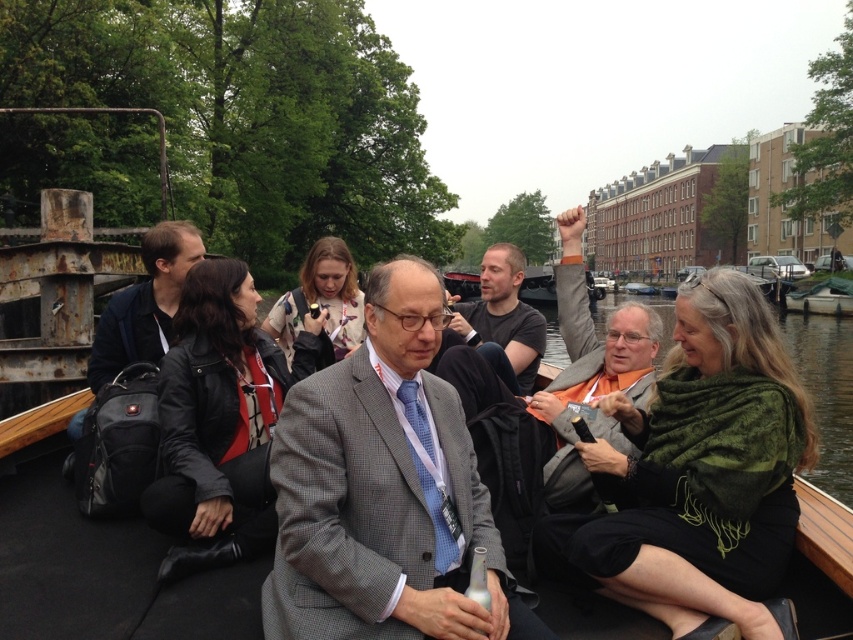
Can you confirm if orange fabric sweater at center is wider than green scarf at upper right?

In fact, orange fabric sweater at center might be narrower than green scarf at upper right.

Is point (646, 397) positioned behind point (660, 301)?

No.

Locate an element on the screen. Image resolution: width=853 pixels, height=640 pixels. orange fabric sweater at center is located at coordinates (589, 364).

Between gray checkered suit at center and green scarf at upper right, which one appears on the left side from the viewer's perspective?

From the viewer's perspective, gray checkered suit at center appears more on the left side.

Who is more distant from viewer, (323, 588) or (807, 365)?

Positioned behind is point (807, 365).

You are a GUI agent. You are given a task and a screenshot of the screen. Output one action in this format:
    pyautogui.click(x=<x>, y=<y>)
    Task: Click on the gray checkered suit at center
    
    Given the screenshot: What is the action you would take?
    pyautogui.click(x=383, y=490)

Can you confirm if green scarf at upper right is thinner than dark gray shirt at center?

No.

How much distance is there between green scarf at upper right and dark gray shirt at center?

green scarf at upper right and dark gray shirt at center are 36.75 meters apart from each other.

Measure the distance between green scarf at upper right and camera.

green scarf at upper right and camera are 17.75 meters apart from each other.

This screenshot has height=640, width=853. What are the coordinates of `green scarf at upper right` in the screenshot? It's located at (827, 394).